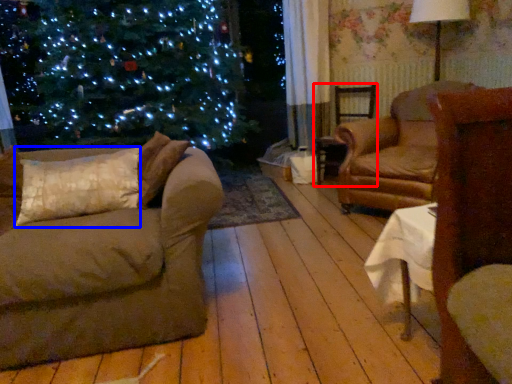
Question: Which object is closer to the camera taking this photo, chair (highlighted by a red box) or pillow (highlighted by a blue box)?

Choices:
 (A) chair
 (B) pillow

Answer: (B)